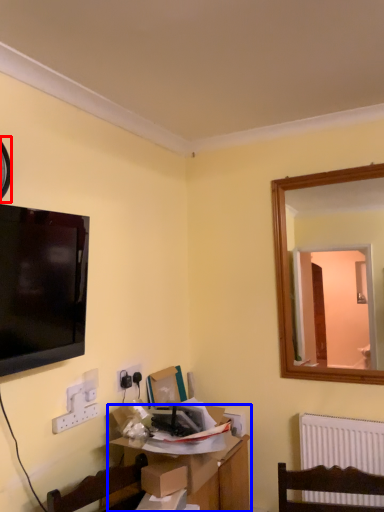
Question: Which object is further to the camera taking this photo, clock (highlighted by a red box) or table (highlighted by a blue box)?

Choices:
 (A) clock
 (B) table

Answer: (B)